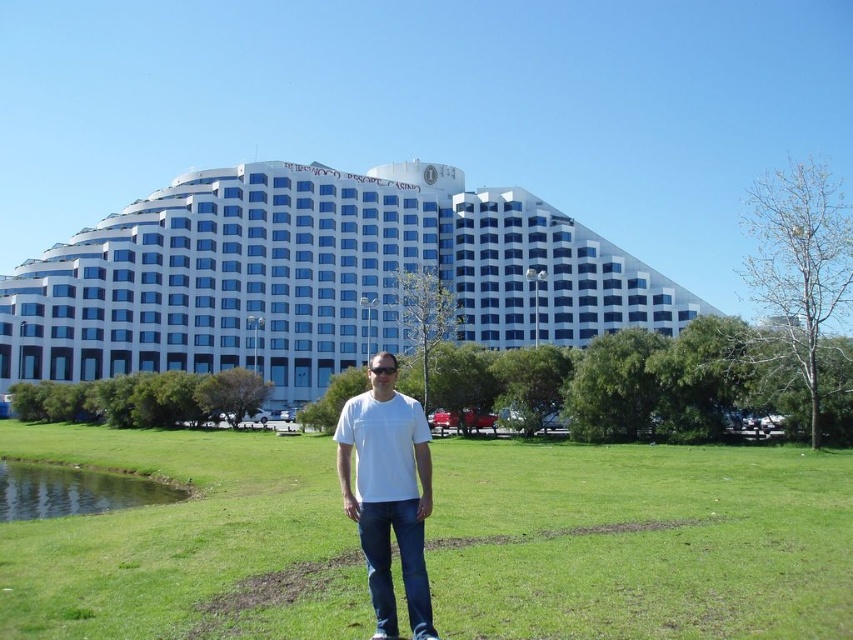
You are standing at the entrance of the building and want to find the green grass at center. According to the coordinates provided, in which direction should you walk to reach it?

The green grass at center is located at coordinates point (x=639, y=541). Since the x and y values are both greater than 0.5, you should walk towards the lower right direction to reach it.

You are a photographer standing on the green grassy lake at lower left and want to take a photo of the white glass building at center. Can you see the building in your camera frame?

The green grassy lake at lower left is behind the white glass building at center, so you cannot see the white glass building at center in your camera frame because the building is in front of you.

You are standing in front of the modern building and see two points marked on the facade. The first point is at coordinates point [68,580] and the second is at point [67,330]. Which point is closer to you?

Point [68,580] is in front of point [67,330], so it is closer to you.